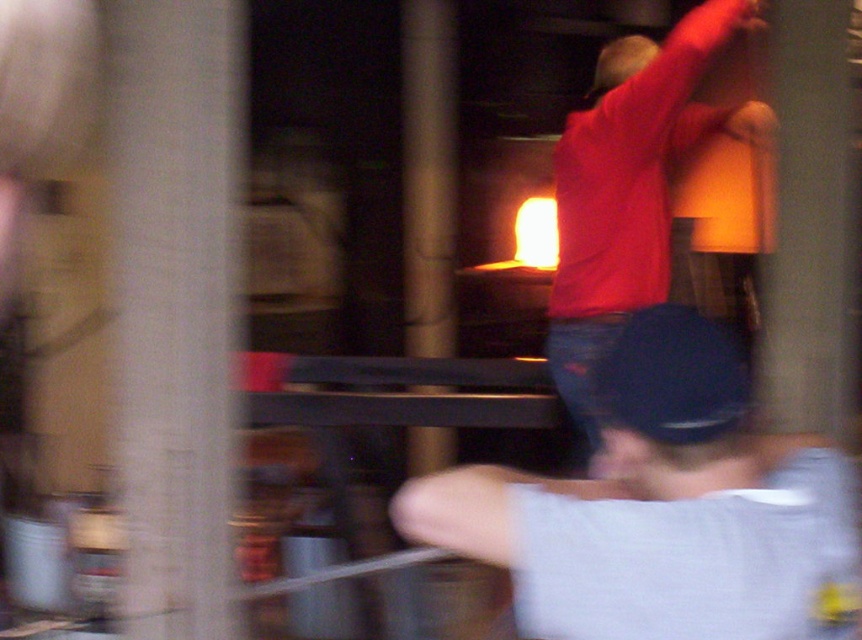
You are an observer in a workshop. You see a person wearing a matte red shirt at center and a black matte baseball hat at center. Which clothing item is bigger in size?

The matte red shirt at center has a larger size compared to the black matte baseball hat at center, so the matte red shirt at center is bigger.

You are an observer in the workshop. You notice the matte red shirt at center and the black matte baseball hat at center. Which object is covering the other?

The matte red shirt at center is positioned over the black matte baseball hat at center, so the shirt is covering the hat.